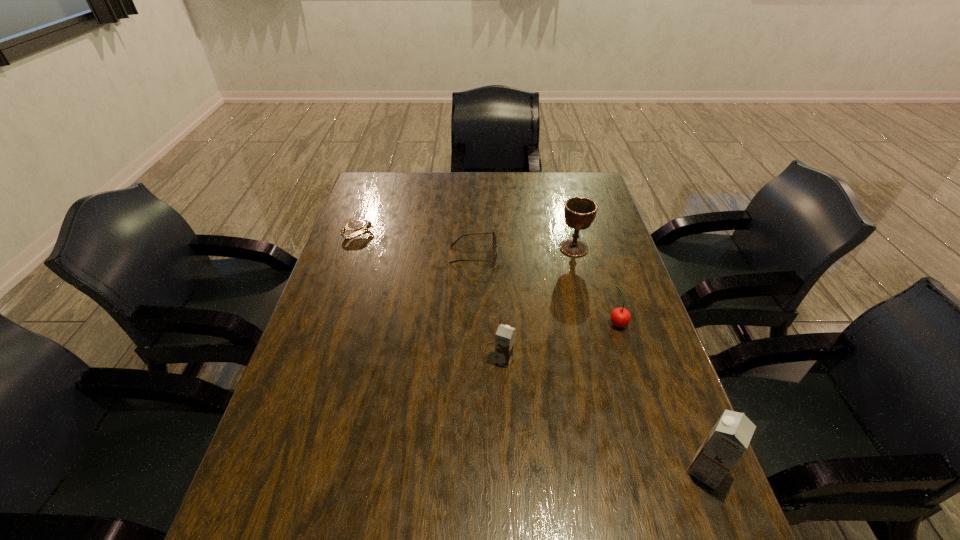
Where is `object that is at the near right corner`? Image resolution: width=960 pixels, height=540 pixels. object that is at the near right corner is located at coordinates (728, 440).

In the image, there is a desktop. Where is `vacant area at the far edge`? The height and width of the screenshot is (540, 960). vacant area at the far edge is located at coordinates (441, 185).

Find the location of `vacant space at the near edge of the desktop`. vacant space at the near edge of the desktop is located at coordinates (551, 495).

This screenshot has width=960, height=540. I want to click on free space at the left edge of the desktop, so click(292, 399).

The height and width of the screenshot is (540, 960). I want to click on free location at the right edge of the desktop, so click(646, 458).

Where is `vacant point at the far left corner`? This screenshot has width=960, height=540. vacant point at the far left corner is located at coordinates (406, 178).

The image size is (960, 540). Identify the location of free location at the near left corner of the desktop. (242, 504).

At what (x,y) coordinates should I click in order to perform the action: click on vacant area at the far right corner. Please return your answer as a coordinate pair (x, y). Looking at the image, I should click on (563, 181).

In the image, there is a desktop. Identify the location of free space at the near right corner. The height and width of the screenshot is (540, 960). (644, 475).

The height and width of the screenshot is (540, 960). What are the coordinates of `free space between the second nearest object and the third nearest object` in the screenshot? It's located at (561, 341).